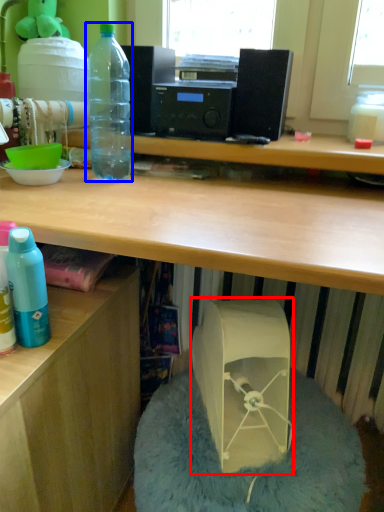
Question: Which object appears farthest to the camera in this image, wide (highlighted by a red box) or bottle (highlighted by a blue box)?

Choices:
 (A) wide
 (B) bottle

Answer: (B)